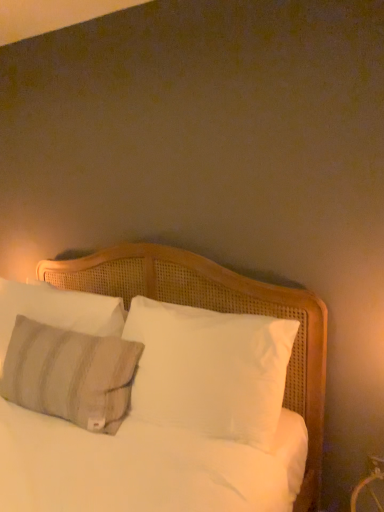
Question: Does textured gray pillow at left, which is counted as the second pillow, starting from the front, come behind textured gray pillow at left, marked as the second pillow in a back-to-front arrangement?

Choices:
 (A) no
 (B) yes

Answer: (B)

Question: Can you confirm if textured gray pillow at left, which is counted as the second pillow, starting from the front, is wider than textured gray pillow at left, marked as the second pillow in a back-to-front arrangement?

Choices:
 (A) yes
 (B) no

Answer: (B)

Question: Does textured gray pillow at left, which is the 1th pillow from back to front, appear on the left side of textured gray pillow at left, the 1th pillow from the front?

Choices:
 (A) yes
 (B) no

Answer: (A)

Question: Is textured gray pillow at left, which is counted as the second pillow, starting from the front, not within textured gray pillow at left, marked as the second pillow in a back-to-front arrangement?

Choices:
 (A) no
 (B) yes

Answer: (B)

Question: From a real-world perspective, is textured gray pillow at left, which is the 1th pillow from back to front, beneath textured gray pillow at left, marked as the second pillow in a back-to-front arrangement?

Choices:
 (A) yes
 (B) no

Answer: (B)

Question: In terms of size, does textured gray pillow at left, marked as the second pillow in a back-to-front arrangement, appear bigger or smaller than textured gray pillow at left, which is the 1th pillow from back to front?

Choices:
 (A) small
 (B) big

Answer: (B)

Question: Is textured gray pillow at left, marked as the second pillow in a back-to-front arrangement, spatially inside textured gray pillow at left, which is the 1th pillow from back to front, or outside of it?

Choices:
 (A) inside
 (B) outside

Answer: (B)

Question: In terms of width, does textured gray pillow at left, marked as the second pillow in a back-to-front arrangement, look wider or thinner when compared to textured gray pillow at left, which is counted as the second pillow, starting from the front?

Choices:
 (A) wide
 (B) thin

Answer: (A)

Question: Considering the positions of textured gray pillow at left, marked as the second pillow in a back-to-front arrangement, and textured gray pillow at left, which is counted as the second pillow, starting from the front, in the image, is textured gray pillow at left, marked as the second pillow in a back-to-front arrangement, taller or shorter than textured gray pillow at left, which is counted as the second pillow, starting from the front,?

Choices:
 (A) short
 (B) tall

Answer: (B)

Question: From the image's perspective, is textured gray pillow at left, which is the 1th pillow from back to front, above or below textured gray pillow at left, marked as the second pillow in a back-to-front arrangement?

Choices:
 (A) above
 (B) below

Answer: (A)

Question: Is textured gray pillow at left, which is counted as the second pillow, starting from the front, to the left or to the right of textured gray pillow at left, marked as the second pillow in a back-to-front arrangement, in the image?

Choices:
 (A) left
 (B) right

Answer: (A)

Question: Considering their positions, is textured gray pillow at left, which is the 1th pillow from back to front, located in front of or behind textured gray pillow at left, marked as the second pillow in a back-to-front arrangement?

Choices:
 (A) front
 (B) behind

Answer: (B)

Question: From a real-world perspective, relative to textured gray pillow at left, marked as the second pillow in a back-to-front arrangement, is textured gray pillow at left, which is the 1th pillow from back to front, vertically above or below?

Choices:
 (A) above
 (B) below

Answer: (A)

Question: Considering the positions of textured gray pillow at left, marked as the second pillow in a back-to-front arrangement, and white woven bed at center in the image, is textured gray pillow at left, marked as the second pillow in a back-to-front arrangement, bigger or smaller than white woven bed at center?

Choices:
 (A) small
 (B) big

Answer: (A)

Question: In terms of width, does textured gray pillow at left, the 1th pillow from the front, look wider or thinner when compared to white woven bed at center?

Choices:
 (A) wide
 (B) thin

Answer: (B)